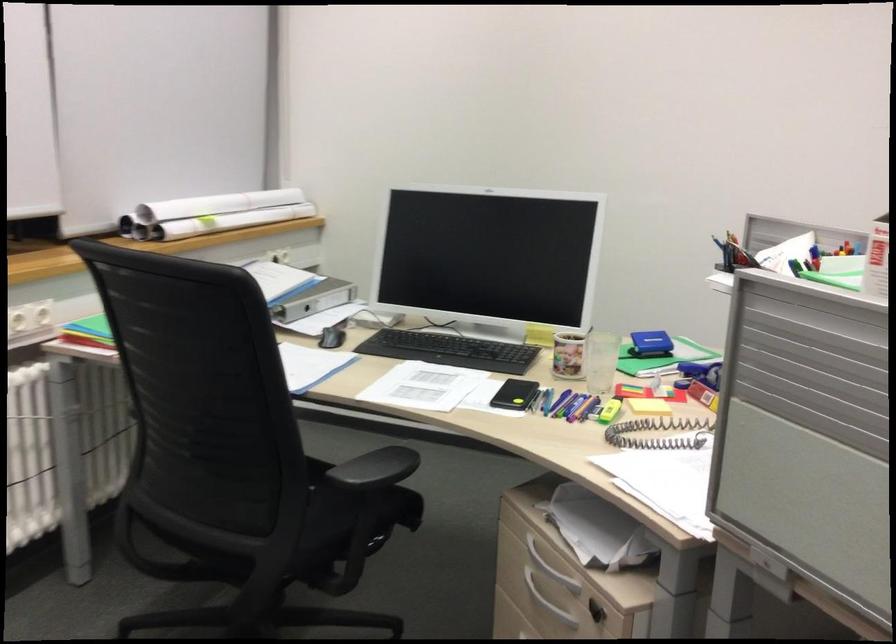
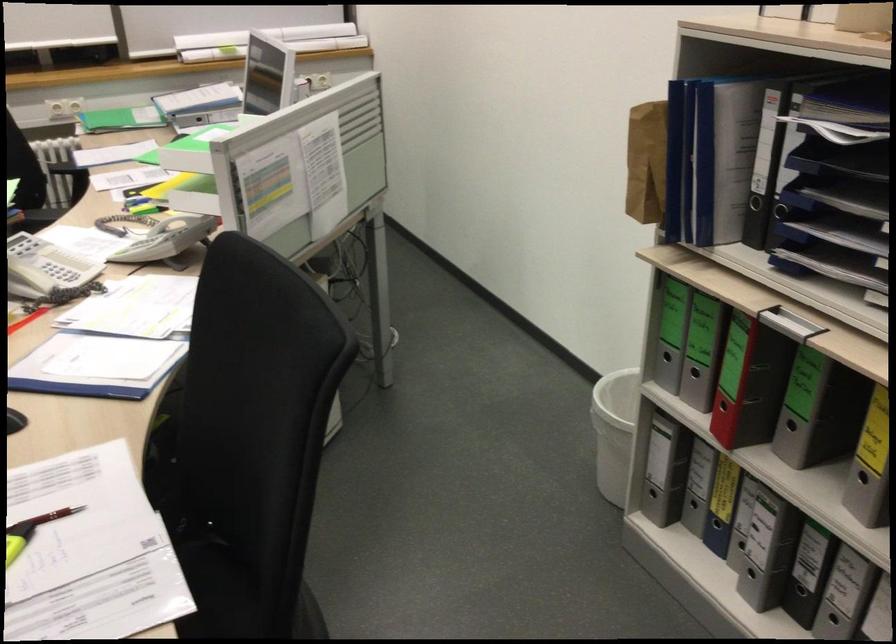
Question: I am providing you with two images of the same scene from different viewpoints. After the viewpoint changes to image2, which objects are now occluded?

Choices:
 (A) blue pen
 (B) black leather chair armrest
 (C) black binder finger hole
 (D) green binder finger hole

Answer: (A)